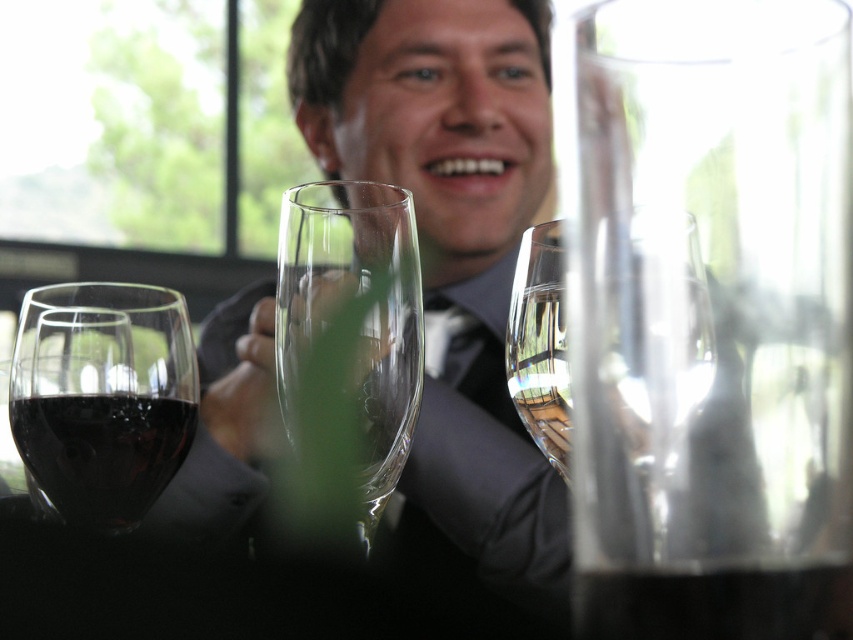
You are a server at a formal event and need to place a dessert plate between the shiny dark red wine glass at left and the transparent glass flute at center. The plate is 3 inches wide. Can you fit it between them without moving the existing glasses?

The shiny dark red wine glass at left and transparent glass flute at center are 2.88 inches apart from each other. Since the dessert plate is 3 inches wide, it cannot fit between them as the space is narrower than the plate.

You are a bartender who needs to choose between the shiny dark red wine glass at left and the transparent glass at right for a cocktail that requires a wide base. Which glass should you select?

The shiny dark red wine glass at left has a greater width than the transparent glass at right, so it is more suitable for the cocktail requiring a wide base.